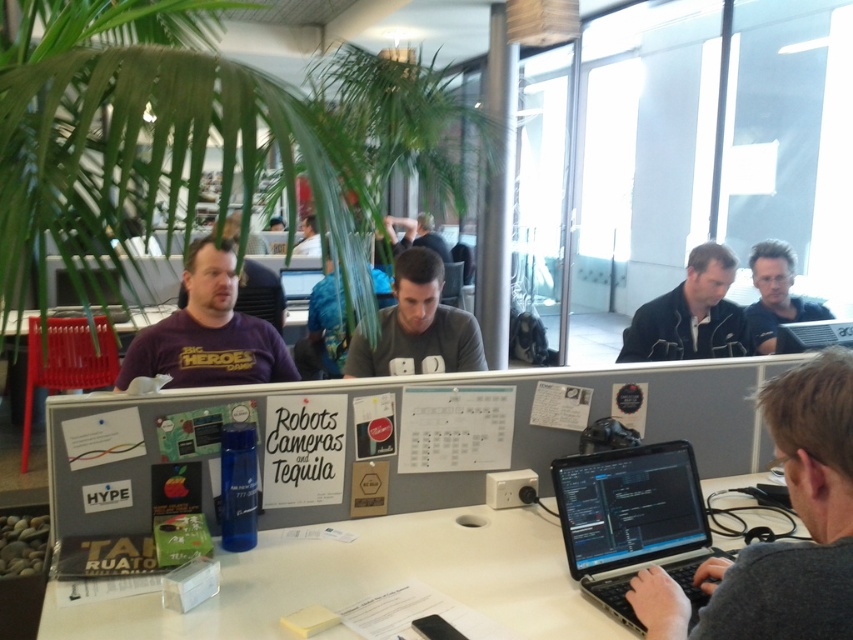
You are standing in the office and want to reach both the point at coordinates (x=764, y=321) and the point at coordinates (x=802, y=340). Which point is closer to you?

Point (x=802, y=340) is closer to you because it is nearer to the camera compared to point (x=764, y=321), which is further away.